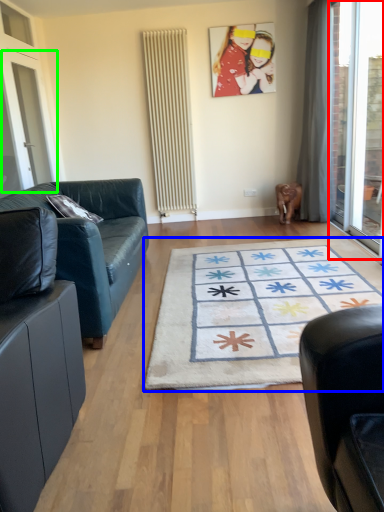
Question: Considering the real-world distances, which object is farthest from window screen (highlighted by a red box)? mat (highlighted by a blue box) or screen door (highlighted by a green box)?

Choices:
 (A) mat
 (B) screen door

Answer: (B)